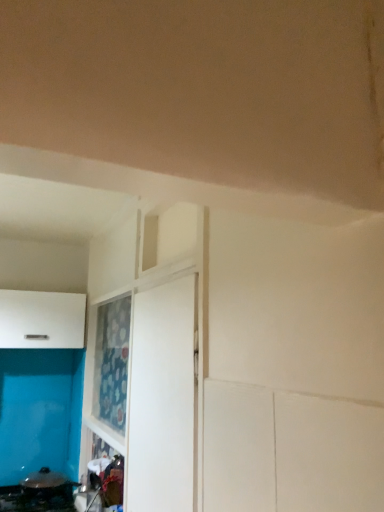
Image resolution: width=384 pixels, height=512 pixels. Describe the element at coordinates (162, 399) in the screenshot. I see `white matte door at center` at that location.

This screenshot has height=512, width=384. What do you see at coordinates (39, 493) in the screenshot?
I see `black glossy pan at lower left` at bounding box center [39, 493].

The height and width of the screenshot is (512, 384). I want to click on white matte door at center, so click(x=162, y=399).

Does black glossy pan at lower left have a smaller size compared to white matte cabinet at left?

Yes.

Is black glossy pan at lower left not near white matte cabinet at left?

They are positioned close to each other.

From the image's perspective, does black glossy pan at lower left appear lower than white matte cabinet at left?

Yes, from the image's perspective, black glossy pan at lower left is beneath white matte cabinet at left.

Which of these two, black glossy pan at lower left or white matte cabinet at left, is wider?

black glossy pan at lower left.

Who is bigger, white matte cabinet at left or white matte door at center?

With larger size is white matte cabinet at left.

Is white matte cabinet at left situated inside white matte door at center or outside?

white matte cabinet at left cannot be found inside white matte door at center.

Are white matte cabinet at left and white matte door at center far apart?

Yes, white matte cabinet at left and white matte door at center are quite far apart.

From the image's perspective, which object appears higher, white matte cabinet at left or white matte door at center?

From the image's view, white matte cabinet at left is above.

From the image's perspective, is white matte door at center above white matte cabinet at left?

No, from the image's perspective, white matte door at center is not above white matte cabinet at left.

Is white matte door at center placed right next to white matte cabinet at left?

white matte door at center is not next to white matte cabinet at left, and they're not touching.

From a real-world perspective, is white matte door at center physically below white matte cabinet at left?

Yes, from a real-world perspective, white matte door at center is below white matte cabinet at left.

Locate an element on the screen. The height and width of the screenshot is (512, 384). door lying on the right of white matte cabinet at left is located at coordinates (162, 399).

Looking at this image, visually, is white matte door at center positioned to the left or to the right of black glossy pan at lower left?

white matte door at center is to the right of black glossy pan at lower left.

Is white matte door at center inside the boundaries of black glossy pan at lower left, or outside?

The correct answer is: outside.

From a real-world perspective, is white matte door at center beneath black glossy pan at lower left?

No, from a real-world perspective, white matte door at center is not under black glossy pan at lower left.

Is point (34, 485) closer to camera compared to point (188, 510)?

No.

You are a GUI agent. You are given a task and a screenshot of the screen. Output one action in this format:
    pyautogui.click(x=<x>, y=<y>)
    Task: Click on the door above the black glossy pan at lower left (from a real-world perspective)
    The width and height of the screenshot is (384, 512).
    Given the screenshot: What is the action you would take?
    pyautogui.click(x=162, y=399)

Does black glossy pan at lower left have a lesser height compared to white matte door at center?

Yes, black glossy pan at lower left is shorter than white matte door at center.

Does black glossy pan at lower left have a smaller size compared to white matte door at center?

No.

Which is behind, white matte cabinet at left or black glossy pan at lower left?

Positioned behind is white matte cabinet at left.

Which is correct: white matte cabinet at left is inside black glossy pan at lower left, or outside of it?

white matte cabinet at left cannot be found inside black glossy pan at lower left.

Considering the sizes of objects white matte cabinet at left and black glossy pan at lower left in the image provided, who is thinner, white matte cabinet at left or black glossy pan at lower left?

With smaller width is white matte cabinet at left.

The width and height of the screenshot is (384, 512). Identify the location of appliance below the white matte cabinet at left (from the image's perspective). (39, 493).

Identify the location of cabinetry on the left of the black glossy pan at lower left. Image resolution: width=384 pixels, height=512 pixels. (41, 320).

In order to click on cabinetry above the white matte door at center (from the image's perspective) in this screenshot , I will do `click(41, 320)`.

Estimate the real-world distances between objects in this image. Which object is closer to white matte cabinet at left, black glossy pan at lower left or white matte door at center?

black glossy pan at lower left is positioned closer to the anchor white matte cabinet at left.

When comparing their distances from white matte door at center, does white matte cabinet at left or black glossy pan at lower left seem closer?

white matte cabinet at left is closer to white matte door at center.

Estimate the real-world distances between objects in this image. Which object is further from black glossy pan at lower left, white matte cabinet at left or white matte door at center?

Based on the image, white matte door at center appears to be further to black glossy pan at lower left.

Which object lies further to the anchor point black glossy pan at lower left, white matte door at center or white matte cabinet at left?

white matte door at center is positioned further to the anchor black glossy pan at lower left.

Looking at the image, which one is located closer to white matte door at center, black glossy pan at lower left or white matte cabinet at left?

white matte cabinet at left is positioned closer to the anchor white matte door at center.

Estimate the real-world distances between objects in this image. Which object is closer to white matte cabinet at left, white matte door at center or black glossy pan at lower left?

black glossy pan at lower left.

This screenshot has height=512, width=384. I want to click on appliance between white matte door at center and white matte cabinet at left in the front-back direction, so click(39, 493).